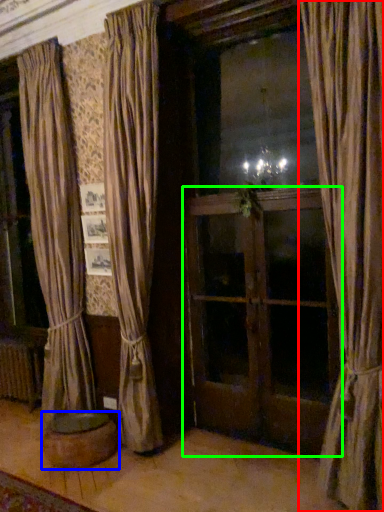
Question: Considering the real-world distances, which object is farthest from curtain (highlighted by a red box)? furniture (highlighted by a blue box) or screen door (highlighted by a green box)?

Choices:
 (A) furniture
 (B) screen door

Answer: (A)